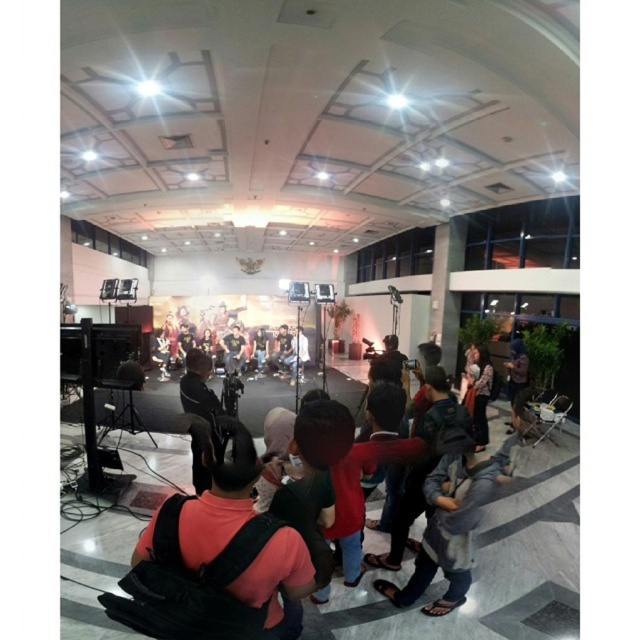
Is matte black backpack at center shorter than matte yellow fabric at center?

Yes.

Which is behind, point (209, 552) or point (244, 342)?

Positioned behind is point (244, 342).

Is point (188, 499) closer to camera compared to point (264, 305)?

Yes, point (188, 499) is closer to viewer.

You are a GUI agent. You are given a task and a screenshot of the screen. Output one action in this format:
    pyautogui.click(x=<x>, y=<y>)
    Task: Click on the matte black backpack at center
    The height and width of the screenshot is (640, 640).
    Given the screenshot: What is the action you would take?
    pyautogui.click(x=218, y=493)

Does matte yellow fabric at center have a greater width compared to matte black camera at center?

Indeed, matte yellow fabric at center has a greater width compared to matte black camera at center.

Can you confirm if matte yellow fabric at center is positioned to the right of matte black camera at center?

Incorrect, matte yellow fabric at center is not on the right side of matte black camera at center.

What do you see at coordinates (230, 324) in the screenshot? The height and width of the screenshot is (640, 640). I see `matte yellow fabric at center` at bounding box center [230, 324].

Where is `matte yellow fabric at center`? This screenshot has width=640, height=640. matte yellow fabric at center is located at coordinates (230, 324).

Does point (240, 456) come in front of point (296, 349)?

Yes, point (240, 456) is closer to viewer.

Between matte black backpack at center and matte black camera at center, which one appears on the right side from the viewer's perspective?

matte black backpack at center

Is point (266, 568) positioned in front of point (300, 340)?

Yes, point (266, 568) is closer to viewer.

Locate an element on the screen. The height and width of the screenshot is (640, 640). matte black backpack at center is located at coordinates (218, 493).